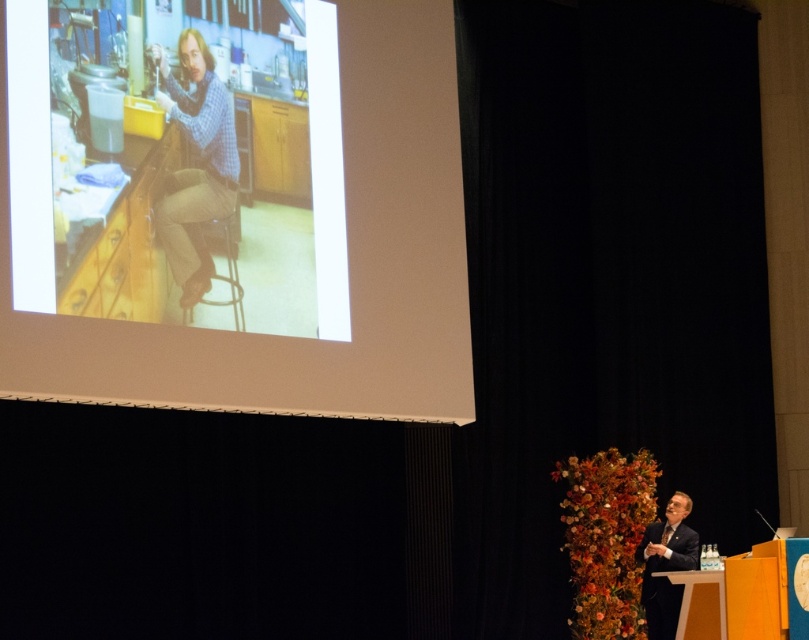
You are an event organizer who needs to place a 3 meter long banner between the white matte projector screen at upper left and the blue checkered shirt at upper left. Is there enough space to fit the banner between them?

The white matte projector screen at upper left and blue checkered shirt at upper left are 2.85 meters apart, so the 3 meter long banner will not fit between them since it is longer than the available space.

You are organizing a photo shoot and need to ensure that all clothing items in the scene are properly framed. Given that the blue checkered shirt at upper left and the dark suit at lower right are both visible in the frame, which clothing item takes up more space in the image?

The dark suit at lower right takes up more space in the image because the blue checkered shirt at upper left occupies less space than it.

Based on the photo, you are standing in the presentation room and want to know which of the two points, point (396, 305) or point (676, 540), is closer to you. Can you determine this based on their positions?

Point (396, 305) is further to the camera than point (676, 540), so the closer point to you is point (676, 540).